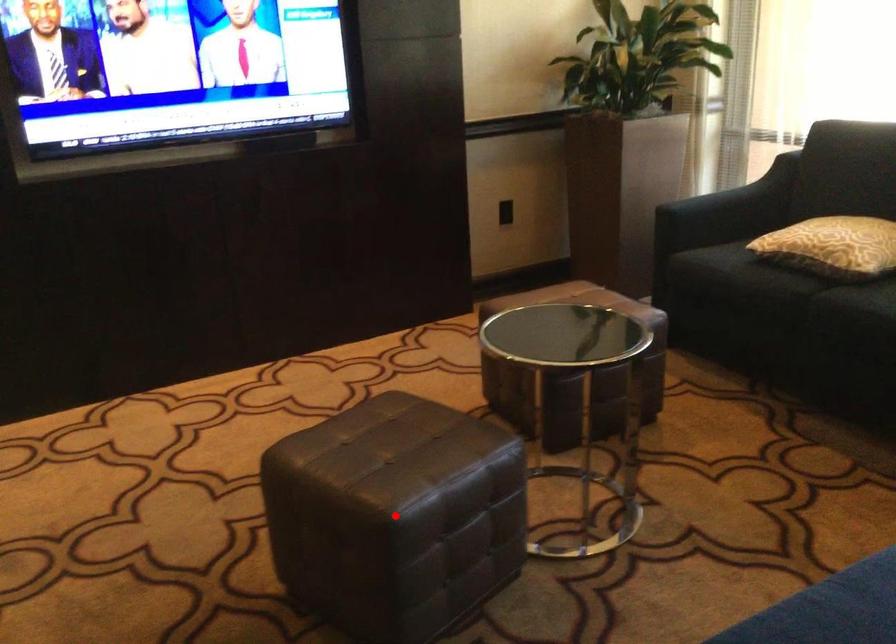
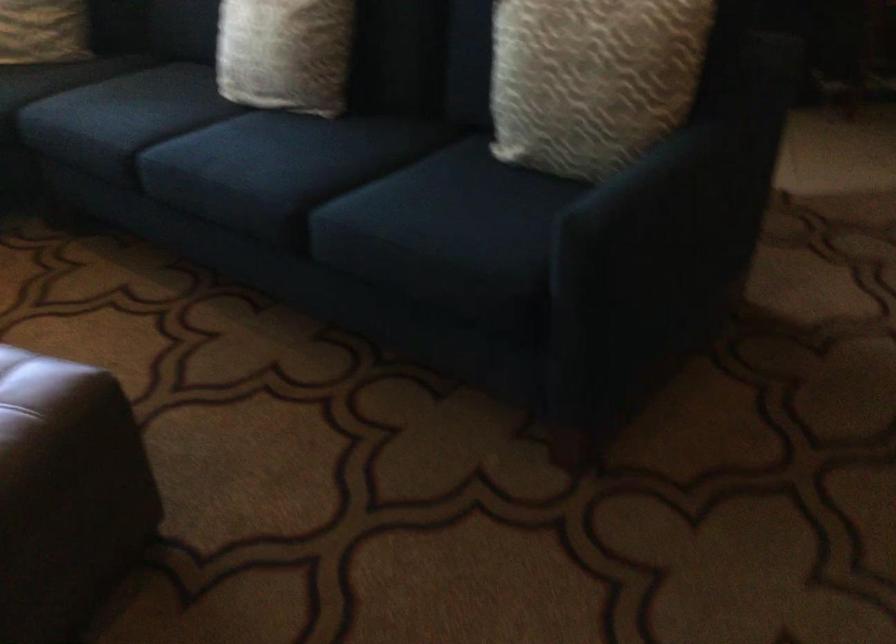
Question: I am providing you with two images of the same scene from different viewpoints. Given a red point in image1, look at the same physical point in image2. Is it:

Choices:
 (A) Closer to the viewpoint
 (B) Farther from the viewpoint

Answer: (B)